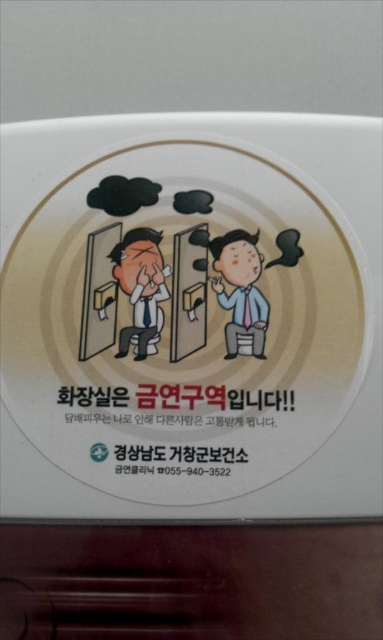
You are standing in front of the sticker and want to locate the matte black man at left. What are the coordinates where you can find him?

The matte black man at left is located at coordinates point (140, 289).

You are designing a poster for a no smoking area in a public restroom. The poster has a sticker with two figures and a warning text. The sticker has a beige background with a gradient. The first figure is a person sitting on a toilet covering their face with hands, and the second figure is a standing person holding a cigarette. There is a black paper text at the center. You need to place the text so it is equidistant between the two figures. Is the current placement of the black paper text at center correct

The black paper text at center is placed exactly between the two figures since they are 79.21 centimeters apart, so the text is correctly positioned equidistant from both figures.

You are examining a sticker that has two points marked on it. The first point is at coordinates point (286, 410), and the second point is at point (132, 230). Which of these points is nearer to you as you look at the sticker?

Point (286, 410) is closer to the camera than point (132, 230), so the first point is nearer to you as you look at the sticker.